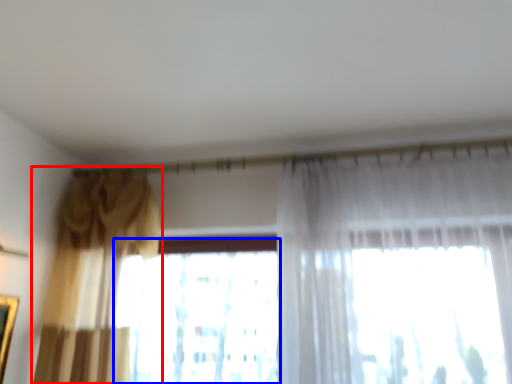
Question: Which object appears farthest to the camera in this image, curtain (highlighted by a red box) or window (highlighted by a blue box)?

Choices:
 (A) curtain
 (B) window

Answer: (B)